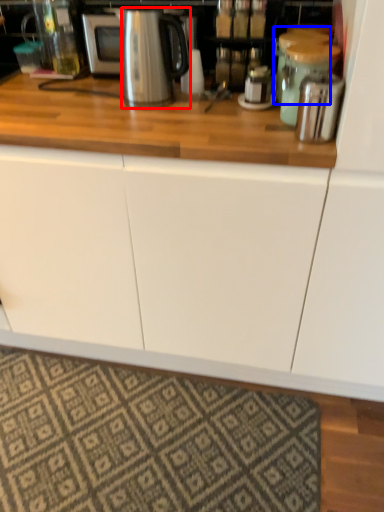
Question: Which object appears farthest to the camera in this image, kitchen appliance (highlighted by a red box) or appliance (highlighted by a blue box)?

Choices:
 (A) kitchen appliance
 (B) appliance

Answer: (B)